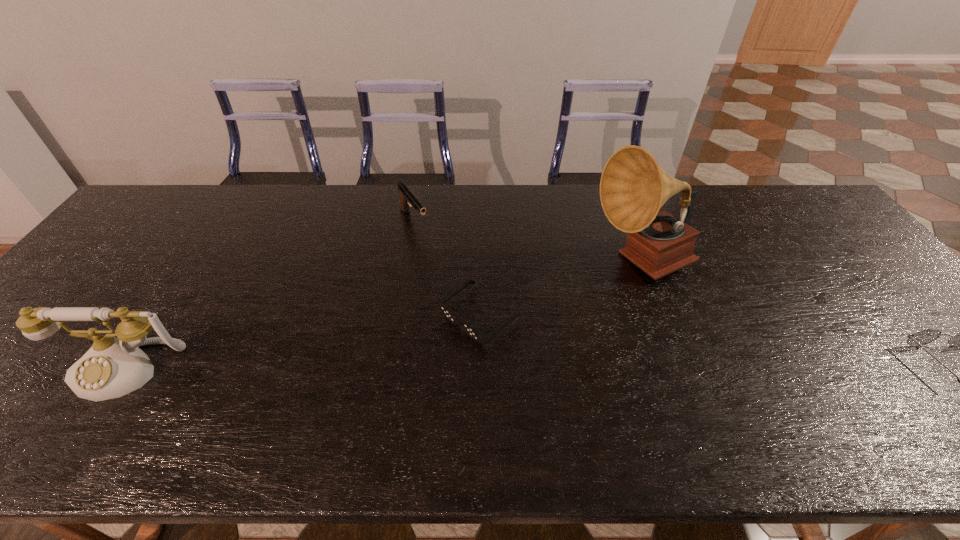
Locate an element on the screen. This screenshot has width=960, height=540. object located in the near left corner section of the desktop is located at coordinates (113, 367).

The image size is (960, 540). I want to click on vacant space at the far edge of the desktop, so click(281, 207).

In the image, there is a desktop. Where is `free space at the near edge`? The width and height of the screenshot is (960, 540). free space at the near edge is located at coordinates (284, 385).

Identify the location of vacant space at the left edge of the desktop. Image resolution: width=960 pixels, height=540 pixels. (14, 349).

In the image, there is a desktop. Where is `vacant space at the right edge`? This screenshot has width=960, height=540. vacant space at the right edge is located at coordinates (856, 321).

Where is `blank space at the far left corner of the desktop`? The image size is (960, 540). blank space at the far left corner of the desktop is located at coordinates (159, 204).

Where is `free spot between the third tallest object and the second object from right to left`? The width and height of the screenshot is (960, 540). free spot between the third tallest object and the second object from right to left is located at coordinates (528, 242).

This screenshot has width=960, height=540. I want to click on free space between the third object from right to left and the telephone, so click(x=302, y=343).

Where is `free area in between the shortest object and the phonograph record`? The height and width of the screenshot is (540, 960). free area in between the shortest object and the phonograph record is located at coordinates (561, 290).

Identify the location of free space that is in between the pistol and the leftmost object. This screenshot has height=540, width=960. (270, 295).